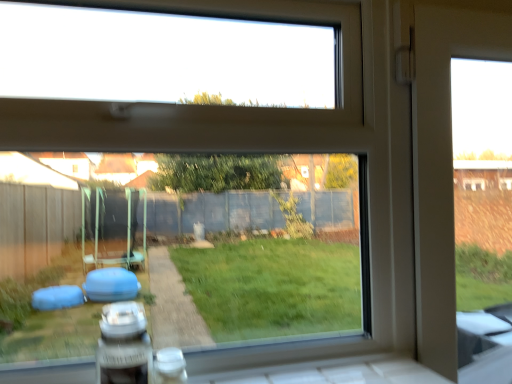
Question: Should I look upward or downward to see white plastic car at lower left?

Choices:
 (A) up
 (B) down

Answer: (B)